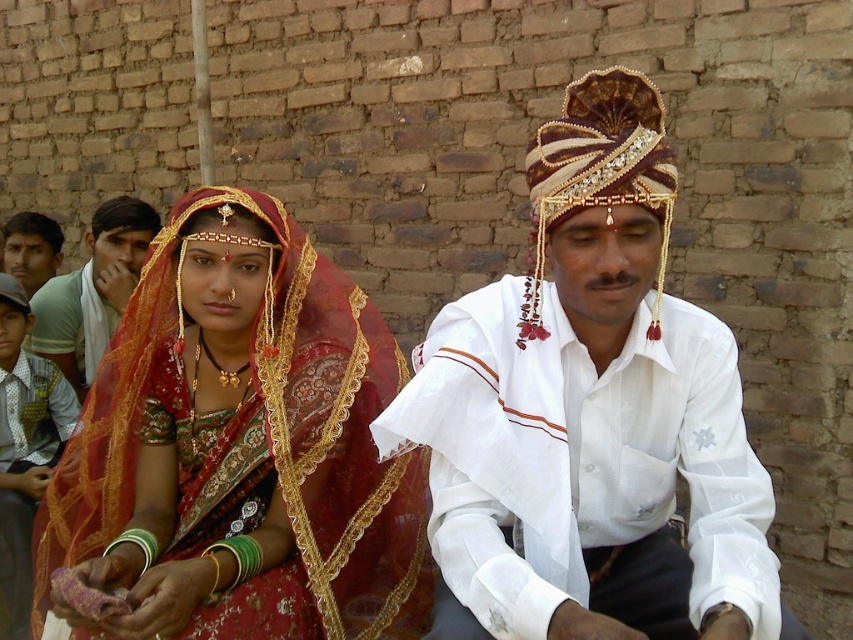
You are a photographer at a wedding and need to capture a shot of the matte red saree at center and the matte green shirt at left. Based on their positions, which one is located to the right of the other?

The matte red saree at center is positioned on the right side of the matte green shirt at left.

You are a photographer taking a picture of the wedding couple. You notice two points in the scene labeled as point 1 at coordinates (x=233, y=342) and point 2 at (x=9, y=252). Which point is closer to your camera lens?

Point 1 at coordinates (x=233, y=342) is closer to the camera lens than point 2 at (x=9, y=252).